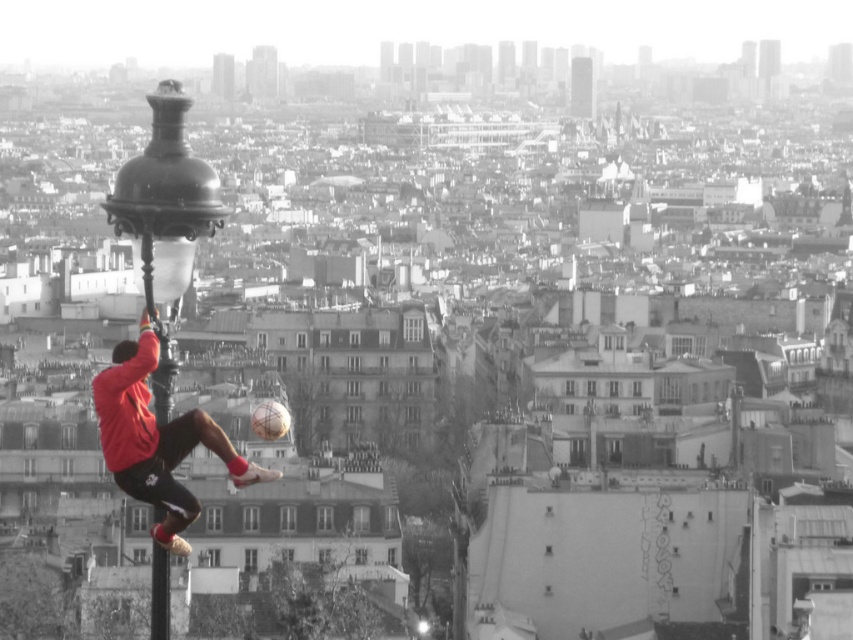
You are a photographer trying to capture a photo of the red matte soccer player at center. To ensure the polished brass lamp post at left doesn

The polished brass lamp post at left is taller than the red matte soccer player at center, so positioning the camera lower to emphasize the lamp post

You are a drone operator trying to capture a photo of the cityscape in the background. You notice two points in the image at coordinates point (171, 448) and point (157, 552). To ensure the cityscape remains the main focus, which point should you avoid placing your drone in front of?

Point (171, 448) is in front of point (157, 552). Therefore, to keep the cityscape as the main focus, you should avoid placing the drone in front of point (171, 448) because it is closer to the camera and might block the view of the cityscape.